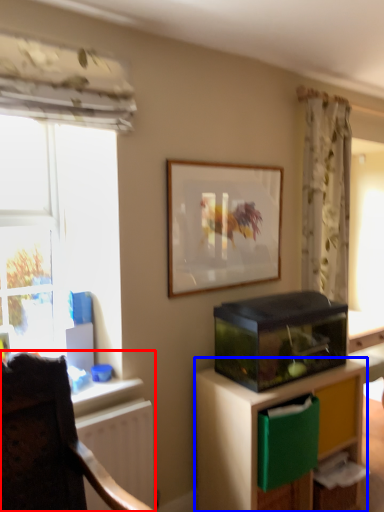
Question: Which of the following is the closest to the observer, chair (highlighted by a red box) or cabinetry (highlighted by a blue box)?

Choices:
 (A) chair
 (B) cabinetry

Answer: (A)